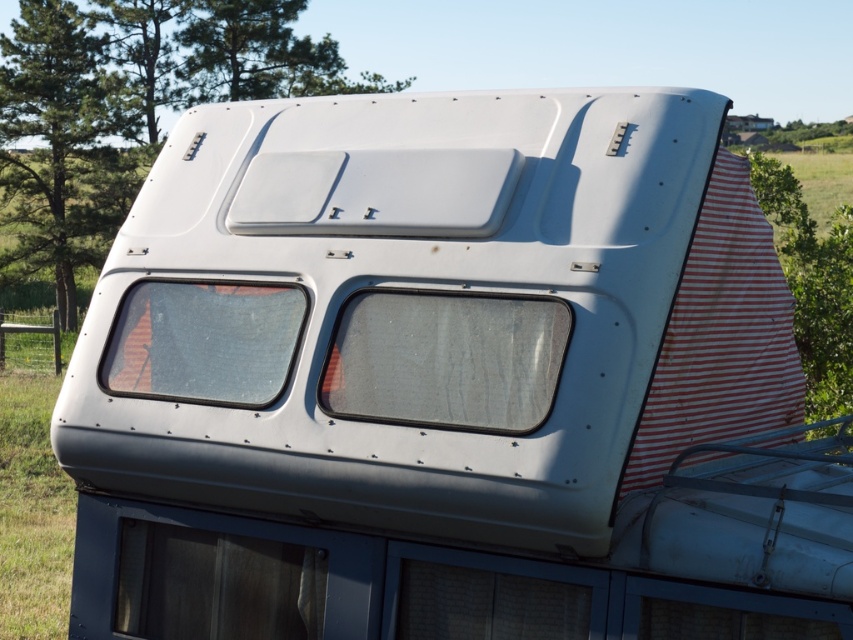
Question: Which object appears farthest from the camera in this image?

Choices:
 (A) transparent glass window at center
 (B) transparent glass window at lower left

Answer: (B)

Question: Is wooden panel at lower left wider than transparent glass window at lower left?

Choices:
 (A) yes
 (B) no

Answer: (A)

Question: Which point is farther to the camera?

Choices:
 (A) (422, 332)
 (B) (138, 620)

Answer: (B)

Question: Which of the following is the closest to the observer?

Choices:
 (A) transparent glass window at center
 (B) transparent glass window at lower left

Answer: (A)

Question: Is wooden panel at lower left behind transparent glass window at lower left?

Choices:
 (A) yes
 (B) no

Answer: (A)

Question: Is wooden panel at lower left closer to camera compared to transparent glass window at lower left?

Choices:
 (A) no
 (B) yes

Answer: (A)